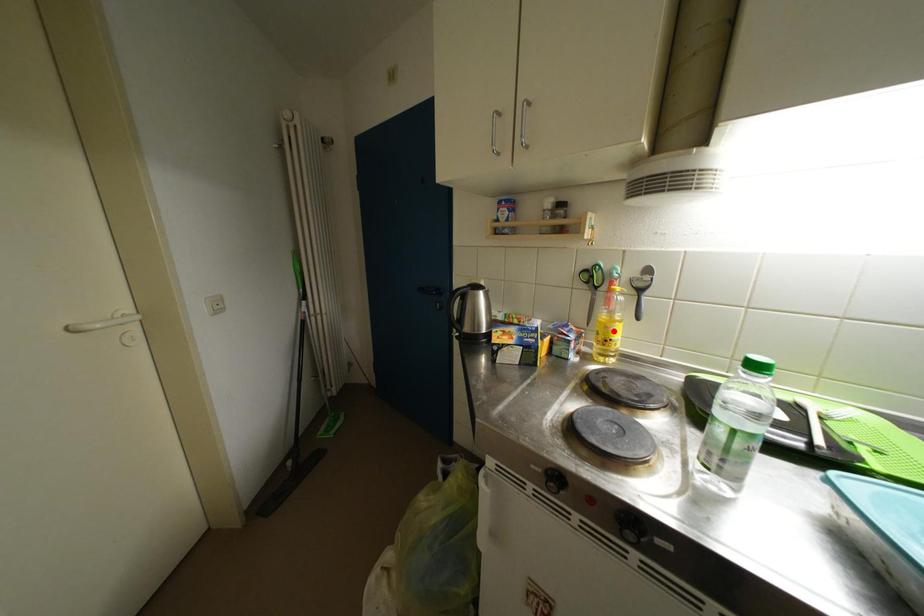
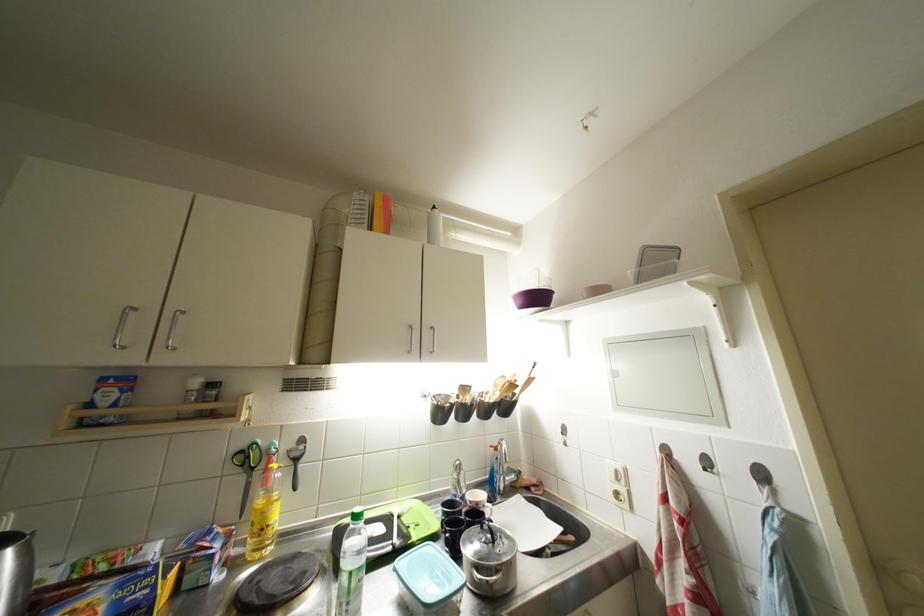
Find the pixel in the second image that matches the highlighted location in the first image.

(271, 517)